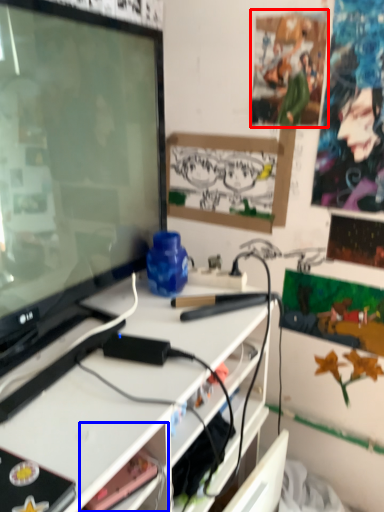
Question: Among these objects, which one is farthest to the camera, poster (highlighted by a red box) or shelf (highlighted by a blue box)?

Choices:
 (A) poster
 (B) shelf

Answer: (A)